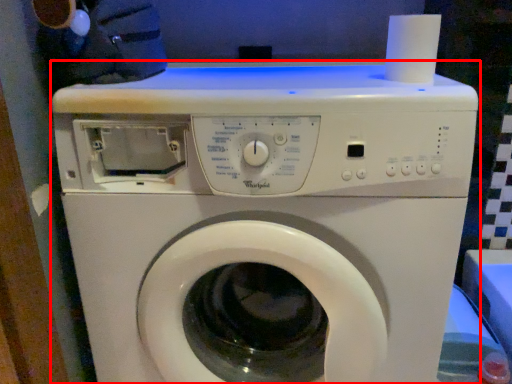
Question: From the image's perspective, where is washing machine (annotated by the red box) located relative to paper towel?

Choices:
 (A) below
 (B) above

Answer: (A)